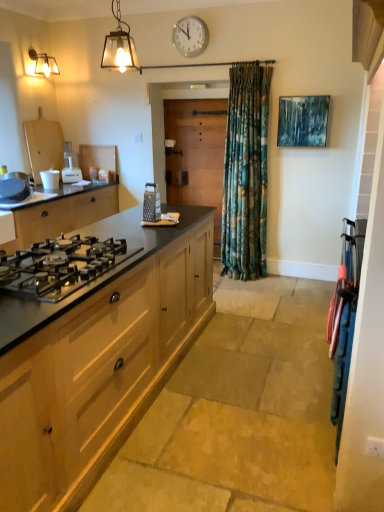
Describe the element at coordinates (62, 214) in the screenshot. I see `matte wooden stove at left, the 2th cabinetry viewed from the front` at that location.

Measure the distance between point (46, 289) and camera.

Point (46, 289) and camera are 5.59 feet apart.

Describe the element at coordinates (60, 266) in the screenshot. The height and width of the screenshot is (512, 384). I see `polished stainless steel gas stove at lower left` at that location.

What do you see at coordinates (119, 46) in the screenshot? Image resolution: width=384 pixels, height=512 pixels. I see `matte glass lantern at upper left` at bounding box center [119, 46].

In order to click on matte wooden stove at left, the second cabinetry in the right-to-left sequence in this screenshot , I will do `click(62, 214)`.

There is a matte glass wall sconce at upper left. Where is `the 2nd cabinetry below it (from the image's perspective)`? The width and height of the screenshot is (384, 512). the 2nd cabinetry below it (from the image's perspective) is located at coordinates (97, 359).

How many degrees apart are the facing directions of light wood/texture cabinet at left, which appears as the 2th cabinetry when viewed from the left, and matte glass wall sconce at upper left?

The facing directions of light wood/texture cabinet at left, which appears as the 2th cabinetry when viewed from the left, and matte glass wall sconce at upper left are 0.39 degrees apart.

Is light wood/texture cabinet at left, which is counted as the 1th cabinetry, starting from the front, oriented away from matte glass wall sconce at upper left?

No, light wood/texture cabinet at left, which is counted as the 1th cabinetry, starting from the front, is not facing the opposite direction of matte glass wall sconce at upper left.

From the image's perspective, which is above, light wood/texture cabinet at left, which appears as the 2th cabinetry when viewed from the left, or matte glass wall sconce at upper left?

matte glass wall sconce at upper left is shown above in the image.

Considering the relative sizes of silver metallic grater at center, the 2th appliance from the bottom, and matte black frying pan at left, arranged as the 3th appliance when viewed from the back, in the image provided, is silver metallic grater at center, the 2th appliance from the bottom, wider than matte black frying pan at left, arranged as the 3th appliance when viewed from the back,?

In fact, silver metallic grater at center, the 2th appliance from the bottom, might be narrower than matte black frying pan at left, arranged as the 3th appliance when viewed from the back.

Considering the sizes of objects silver metallic grater at center, the 2th appliance from the bottom, and matte black frying pan at left, arranged as the 3th appliance when viewed from the back, in the image provided, who is taller, silver metallic grater at center, the 2th appliance from the bottom, or matte black frying pan at left, arranged as the 3th appliance when viewed from the back,?

Standing taller between the two is matte black frying pan at left, arranged as the 3th appliance when viewed from the back.

What's the angular difference between silver metallic grater at center, arranged as the second appliance when viewed from the front, and matte black frying pan at left, the third appliance viewed from the top,'s facing directions?

4.87 degrees.

Based on the photo, which object is further away from the camera taking this photo, silver metallic grater at center, placed as the 4th appliance when sorted from left to right, or matte black frying pan at left, which is counted as the third appliance, starting from the front?

matte black frying pan at left, which is counted as the third appliance, starting from the front, is further from the camera.

Which is farther, (145, 220) or (117, 51)?

The point (117, 51) is farther.

Based on the photo, is silver metallic grater at center, placed as the 4th appliance when sorted from left to right, in front of matte glass lantern at upper left?

No, silver metallic grater at center, placed as the 4th appliance when sorted from left to right, is behind matte glass lantern at upper left.

Is silver metallic grater at center, arranged as the second appliance when viewed from the front, aimed at matte glass lantern at upper left?

No, silver metallic grater at center, arranged as the second appliance when viewed from the front, is not facing towards matte glass lantern at upper left.

Considering the sizes of objects silver metallic grater at center, arranged as the second appliance when viewed from the front, and matte glass lantern at upper left in the image provided, who is thinner, silver metallic grater at center, arranged as the second appliance when viewed from the front, or matte glass lantern at upper left?

silver metallic grater at center, arranged as the second appliance when viewed from the front, is thinner.

What are the coordinates of `cabinetry to the left of polished stainless steel gas stove at lower left` in the screenshot? It's located at (62, 214).

Does polished stainless steel gas stove at lower left have a smaller size compared to matte wooden stove at left, the second cabinetry in the right-to-left sequence?

Indeed, polished stainless steel gas stove at lower left has a smaller size compared to matte wooden stove at left, the second cabinetry in the right-to-left sequence.

Is polished stainless steel gas stove at lower left with matte wooden stove at left, the second cabinetry in the right-to-left sequence?

No.

From a real-world perspective, is matte black frying pan at left, the third appliance when ordered from bottom to top, positioned above or below white plastic appliance at center-left, which ranks as the 5th appliance in front-to-back order?

matte black frying pan at left, the third appliance when ordered from bottom to top, is below white plastic appliance at center-left, which ranks as the 5th appliance in front-to-back order.

From the image's perspective, is matte black frying pan at left, which is counted as the third appliance, starting from the front, above white plastic appliance at center-left, the third appliance from the right?

Actually, matte black frying pan at left, which is counted as the third appliance, starting from the front, appears below white plastic appliance at center-left, the third appliance from the right, in the image.

Who is shorter, matte black frying pan at left, the third appliance when ordered from bottom to top, or white plastic appliance at center-left, which ranks as the 5th appliance in front-to-back order?

matte black frying pan at left, the third appliance when ordered from bottom to top, is shorter.

Is matte black frying pan at left, the third appliance viewed from the top, far from white plastic appliance at center-left, the 5th appliance positioned from the bottom?

No, matte black frying pan at left, the third appliance viewed from the top, is not far away from white plastic appliance at center-left, the 5th appliance positioned from the bottom.

Which of these two, white matte cup at left, placed as the second appliance when sorted from left to right, or blue metallic suitcase at right, which appears as the 1th appliance when viewed from the front, is bigger?

Bigger between the two is blue metallic suitcase at right, which appears as the 1th appliance when viewed from the front.

Measure the distance between white matte cup at left, arranged as the second appliance when viewed from the back, and blue metallic suitcase at right, the 1th appliance viewed from the right.

They are 2.79 meters apart.

Could you tell me if white matte cup at left, which ranks as the 2th appliance in top-to-bottom order, is facing blue metallic suitcase at right, which is the fifth appliance in back-to-front order?

Yes, white matte cup at left, which ranks as the 2th appliance in top-to-bottom order, is facing blue metallic suitcase at right, which is the fifth appliance in back-to-front order.

Between white matte cup at left, positioned as the 4th appliance in right-to-left order, and blue metallic suitcase at right, which is the fifth appliance in back-to-front order, which one has larger width?

Wider between the two is white matte cup at left, positioned as the 4th appliance in right-to-left order.

Is white plastic clock at upper center positioned with its back to matte black frying pan at left, which ranks as the fifth appliance in right-to-left order?

No, white plastic clock at upper center's orientation is not away from matte black frying pan at left, which ranks as the fifth appliance in right-to-left order.

Considering the sizes of white plastic clock at upper center and matte black frying pan at left, the third appliance viewed from the top, in the image, is white plastic clock at upper center bigger or smaller than matte black frying pan at left, the third appliance viewed from the top,?

Considering their sizes, white plastic clock at upper center takes up less space than matte black frying pan at left, the third appliance viewed from the top.

Which is in front, point (186, 24) or point (14, 192)?

Point (14, 192)

Is white plastic clock at upper center not close to matte black frying pan at left, which ranks as the fifth appliance in right-to-left order?

white plastic clock at upper center is far away from matte black frying pan at left, which ranks as the fifth appliance in right-to-left order.

From the image's perspective, starting from the matte glass wall sconce at upper left, which cabinetry is the 2nd one below? Please provide its 2D coordinates.

[(97, 359)]

You are a GUI agent. You are given a task and a screenshot of the screen. Output one action in this format:
    pyautogui.click(x=<x>, y=<y>)
    Task: Click on the 1st appliance above when counting from the silver metallic grater at center, the second appliance when ordered from right to left (from the image's perspective)
    This screenshot has width=384, height=512.
    Given the screenshot: What is the action you would take?
    pyautogui.click(x=14, y=187)

Looking at the image, which one is located further to white plastic clock at upper center, white matte cup at left, placed as the second appliance when sorted from left to right, or matte glass lantern at upper left?

white matte cup at left, placed as the second appliance when sorted from left to right.

Based on their spatial positions, is matte glass lantern at upper left or wooden screen door at center closer to white plastic clock at upper center?

Among the two, wooden screen door at center is located nearer to white plastic clock at upper center.

Looking at the image, which one is located closer to silver metallic grater at center, the 2th appliance from the bottom, matte glass wall sconce at upper left or white matte cup at left, placed as the second appliance when sorted from left to right?

white matte cup at left, placed as the second appliance when sorted from left to right, lies closer to silver metallic grater at center, the 2th appliance from the bottom, than the other object.

Which object lies nearer to the anchor point wooden screen door at center, light wood/texture cabinet at left, which appears as the 2th cabinetry when viewed from the back, or polished stainless steel gas stove at lower left?

The object closer to wooden screen door at center is light wood/texture cabinet at left, which appears as the 2th cabinetry when viewed from the back.

In the scene shown: Estimate the real-world distances between objects in this image. Which object is closer to silver metallic grater at center, placed as the 4th appliance when sorted from left to right, white plastic appliance at center-left, the 1th appliance in the back-to-front sequence, or matte glass wall sconce at upper left?

white plastic appliance at center-left, the 1th appliance in the back-to-front sequence, is closer to silver metallic grater at center, placed as the 4th appliance when sorted from left to right.

When comparing their distances from matte wooden stove at left, the second cabinetry in the right-to-left sequence, does silver metallic grater at center, placed as the 4th appliance when sorted from left to right, or light wood/texture cabinet at left, which appears as the 2th cabinetry when viewed from the left, seem closer?

silver metallic grater at center, placed as the 4th appliance when sorted from left to right.

Estimate the real-world distances between objects in this image. Which object is closer to matte wooden stove at left, the first cabinetry in the back-to-front sequence, wooden screen door at center or matte glass lantern at upper left?

wooden screen door at center lies closer to matte wooden stove at left, the first cabinetry in the back-to-front sequence, than the other object.

Which object lies nearer to the anchor point wooden screen door at center, silver metallic grater at center, the fourth appliance viewed from the back, or polished stainless steel gas stove at lower left?

silver metallic grater at center, the fourth appliance viewed from the back, lies closer to wooden screen door at center than the other object.

At what (x,y) coordinates should I click in order to perform the action: click on cabinetry between polished stainless steel gas stove at lower left and wooden screen door at center in the front-back direction. Please return your answer as a coordinate pair (x, y). This screenshot has height=512, width=384. Looking at the image, I should click on (62, 214).

Where is `light fixture between blue metallic suitcase at right, which appears as the 1th appliance when viewed from the front, and matte glass wall sconce at upper left in the front-back direction`? Image resolution: width=384 pixels, height=512 pixels. light fixture between blue metallic suitcase at right, which appears as the 1th appliance when viewed from the front, and matte glass wall sconce at upper left in the front-back direction is located at coordinates (119, 46).

I want to click on cabinetry positioned between polished stainless steel gas stove at lower left and matte black frying pan at left, the third appliance viewed from the top, from near to far, so click(x=62, y=214).

What are the coordinates of `appliance between light wood/texture cabinet at left, which is counted as the 1th cabinetry, starting from the front, and blue metallic suitcase at right, which is counted as the 1th appliance, starting from the bottom, from left to right` in the screenshot? It's located at (151, 203).